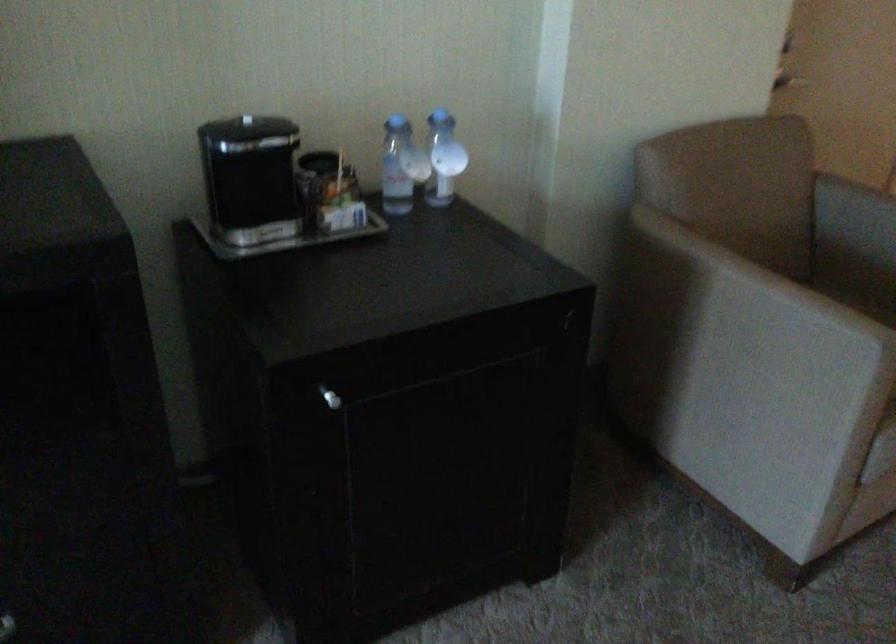
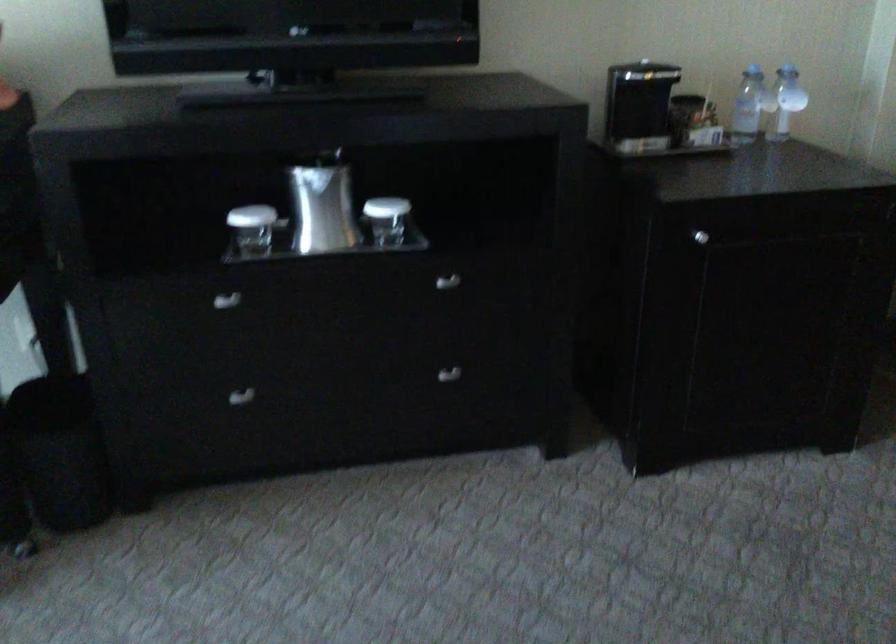
Question: Which direction would the cameraman need to move to produce the second image? Reply with the corresponding letter.

Choices:
 (A) Left
 (B) Right
 (C) Forward
 (D) Backward

Answer: (D)